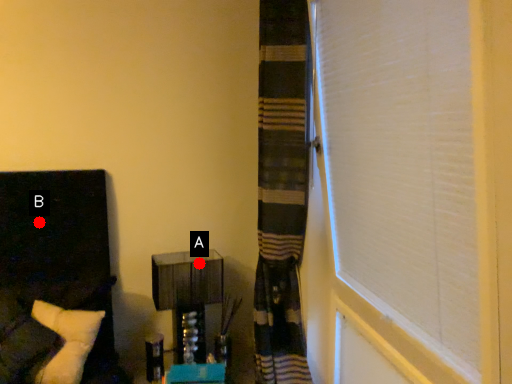
Question: Two points are circled on the image, labeled by A and B beside each circle. Among these points, which one is nearest to the camera?

Choices:
 (A) A is closer
 (B) B is closer

Answer: (B)